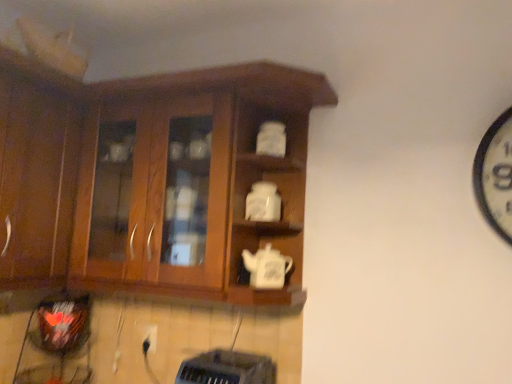
This screenshot has height=384, width=512. I want to click on white matte teapot at center, placed as the 1th teapot when sorted from top to bottom, so click(263, 203).

The image size is (512, 384). I want to click on wooden cabinet at left, arranged as the second cabinetry when viewed from the right, so click(x=37, y=170).

What do you see at coordinates (37, 170) in the screenshot?
I see `wooden cabinet at left, arranged as the second cabinetry when viewed from the right` at bounding box center [37, 170].

This screenshot has width=512, height=384. Find the location of `wooden cabinet at center, which is the first cabinetry from right to left`. wooden cabinet at center, which is the first cabinetry from right to left is located at coordinates (146, 176).

The height and width of the screenshot is (384, 512). I want to click on white matte teapot at center, the 1th teapot from the bottom, so click(x=267, y=267).

The image size is (512, 384). What do you see at coordinates (150, 339) in the screenshot? I see `white plastic electric outlet at lower center` at bounding box center [150, 339].

What are the coordinates of `white matte teapot at center, placed as the 1th teapot when sorted from top to bottom` in the screenshot? It's located at (263, 203).

Which is in front, point (69, 211) or point (256, 213)?

The point (256, 213) is in front.

Would you consider wooden cabinet at left, which appears as the first cabinetry when viewed from the left, to be distant from white matte teapot at center, placed as the 1th teapot when sorted from top to bottom?

That's not correct — wooden cabinet at left, which appears as the first cabinetry when viewed from the left, is a little close to white matte teapot at center, placed as the 1th teapot when sorted from top to bottom.

Would you say wooden cabinet at left, arranged as the second cabinetry when viewed from the right, is to the left or to the right of white matte teapot at center, the 2th teapot ordered from the bottom, in the picture?

wooden cabinet at left, arranged as the second cabinetry when viewed from the right, is to the left of white matte teapot at center, the 2th teapot ordered from the bottom.

Who is smaller, wooden cabinet at center, the second cabinetry in the left-to-right sequence, or black plastic toaster at lower center?

Smaller between the two is black plastic toaster at lower center.

Is wooden cabinet at center, which is the first cabinetry from right to left, thinner than black plastic toaster at lower center?

Yes, wooden cabinet at center, which is the first cabinetry from right to left, is thinner than black plastic toaster at lower center.

This screenshot has height=384, width=512. I want to click on appliance beneath the wooden cabinet at center, the second cabinetry in the left-to-right sequence (from a real-world perspective), so click(227, 368).

Does wooden cabinet at center, the second cabinetry in the left-to-right sequence, have a lesser height compared to black plastic toaster at lower center?

In fact, wooden cabinet at center, the second cabinetry in the left-to-right sequence, may be taller than black plastic toaster at lower center.

Between black plastic toaster at lower center and wooden cabinet at left, which appears as the first cabinetry when viewed from the left, which one appears on the right side from the viewer's perspective?

From the viewer's perspective, black plastic toaster at lower center appears more on the right side.

From a real-world perspective, between black plastic toaster at lower center and wooden cabinet at left, arranged as the second cabinetry when viewed from the right, who is vertically lower?

black plastic toaster at lower center, from a real-world perspective.

Is point (211, 379) closer or farther from the camera than point (16, 95)?

Point (211, 379).

From the picture: Are black plastic toaster at lower center and wooden cabinet at left, arranged as the second cabinetry when viewed from the right, beside each other?

No.

How different are the orientations of white plastic electric outlet at lower center and white matte teapot at center, the 2th teapot when ordered from top to bottom, in degrees?

The angle between the facing direction of white plastic electric outlet at lower center and the facing direction of white matte teapot at center, the 2th teapot when ordered from top to bottom, is 3.34 degrees.

Considering the sizes of objects white plastic electric outlet at lower center and white matte teapot at center, the 1th teapot from the bottom, in the image provided, who is thinner, white plastic electric outlet at lower center or white matte teapot at center, the 1th teapot from the bottom,?

white plastic electric outlet at lower center.

Between point (153, 348) and point (257, 283), which one is positioned behind?

The point (153, 348) is farther.

Is white plastic electric outlet at lower center next to white matte teapot at center, the 1th teapot from the bottom, and touching it?

white plastic electric outlet at lower center is not next to white matte teapot at center, the 1th teapot from the bottom, and they're not touching.

Are white matte teapot at center, the 1th teapot from the bottom, and white plastic electric outlet at lower center far apart?

No, white matte teapot at center, the 1th teapot from the bottom, is not far away from white plastic electric outlet at lower center.

Between white matte teapot at center, the 1th teapot from the bottom, and white plastic electric outlet at lower center, which one appears on the left side from the viewer's perspective?

Positioned to the left is white plastic electric outlet at lower center.

From the image's perspective, which object appears higher, white matte teapot at center, the 2th teapot when ordered from top to bottom, or white plastic electric outlet at lower center?

From the image's view, white matte teapot at center, the 2th teapot when ordered from top to bottom, is above.

From a real-world perspective, between white matte teapot at center, the 1th teapot from the bottom, and white plastic electric outlet at lower center, who is vertically lower?

white plastic electric outlet at lower center is physically lower.

How much distance is there between wooden cabinet at center, the second cabinetry in the left-to-right sequence, and white matte teapot at center, placed as the 1th teapot when sorted from top to bottom?

wooden cabinet at center, the second cabinetry in the left-to-right sequence, and white matte teapot at center, placed as the 1th teapot when sorted from top to bottom, are 17.66 inches apart.

Is wooden cabinet at center, which is the first cabinetry from right to left, turned away from white matte teapot at center, the 2th teapot ordered from the bottom?

Yes, wooden cabinet at center, which is the first cabinetry from right to left, is facing away from white matte teapot at center, the 2th teapot ordered from the bottom.

Is white matte teapot at center, placed as the 1th teapot when sorted from top to bottom, completely or partially inside wooden cabinet at center, the second cabinetry in the left-to-right sequence?

Yes, wooden cabinet at center, the second cabinetry in the left-to-right sequence, contains white matte teapot at center, placed as the 1th teapot when sorted from top to bottom.

Considering the sizes of wooden cabinet at center, the second cabinetry in the left-to-right sequence, and white matte teapot at center, placed as the 1th teapot when sorted from top to bottom, in the image, is wooden cabinet at center, the second cabinetry in the left-to-right sequence, wider or thinner than white matte teapot at center, placed as the 1th teapot when sorted from top to bottom,?

wooden cabinet at center, the second cabinetry in the left-to-right sequence, is wider than white matte teapot at center, placed as the 1th teapot when sorted from top to bottom.

Between white plastic electric outlet at lower center and wooden cabinet at center, the second cabinetry in the left-to-right sequence, which one has less height?

With less height is white plastic electric outlet at lower center.

The height and width of the screenshot is (384, 512). I want to click on electric outlet behind the wooden cabinet at center, the second cabinetry in the left-to-right sequence, so click(x=150, y=339).

From the image's perspective, is white plastic electric outlet at lower center beneath wooden cabinet at center, the second cabinetry in the left-to-right sequence?

Yes, from the image's perspective, white plastic electric outlet at lower center is beneath wooden cabinet at center, the second cabinetry in the left-to-right sequence.

I want to click on the 1st teapot counting from the right of the wooden cabinet at left, which appears as the first cabinetry when viewed from the left, so click(263, 203).

In order to click on appliance below the wooden cabinet at center, the second cabinetry in the left-to-right sequence (from a real-world perspective) in this screenshot , I will do `click(227, 368)`.

Based on their spatial positions, is wooden cabinet at left, which appears as the first cabinetry when viewed from the left, or white plastic electric outlet at lower center closer to white matte teapot at center, the 1th teapot from the bottom?

white plastic electric outlet at lower center.

Looking at the image, which one is located further to black plastic toaster at lower center, white matte teapot at center, the 1th teapot from the bottom, or white matte teapot at center, the 2th teapot ordered from the bottom?

white matte teapot at center, the 2th teapot ordered from the bottom, lies further to black plastic toaster at lower center than the other object.

Looking at the image, which one is located closer to black plastic toaster at lower center, wooden cabinet at center, the second cabinetry in the left-to-right sequence, or white matte teapot at center, the 2th teapot ordered from the bottom?

white matte teapot at center, the 2th teapot ordered from the bottom, is positioned closer to the anchor black plastic toaster at lower center.

Consider the image. Based on their spatial positions, is black plastic toaster at lower center or wooden cabinet at left, which appears as the first cabinetry when viewed from the left, closer to wooden cabinet at center, which is the first cabinetry from right to left?

wooden cabinet at left, which appears as the first cabinetry when viewed from the left, is positioned closer to the anchor wooden cabinet at center, which is the first cabinetry from right to left.

Which object lies nearer to the anchor point white matte teapot at center, the 2th teapot ordered from the bottom, white matte teapot at center, the 1th teapot from the bottom, or wooden cabinet at left, arranged as the second cabinetry when viewed from the right?

white matte teapot at center, the 1th teapot from the bottom, is closer to white matte teapot at center, the 2th teapot ordered from the bottom.

Based on their spatial positions, is wooden cabinet at center, the second cabinetry in the left-to-right sequence, or white plastic electric outlet at lower center further from white matte teapot at center, placed as the 1th teapot when sorted from top to bottom?

white plastic electric outlet at lower center.

Considering their positions, is wooden cabinet at left, arranged as the second cabinetry when viewed from the right, positioned further to white matte teapot at center, the 2th teapot ordered from the bottom, than white matte teapot at center, the 2th teapot when ordered from top to bottom?

wooden cabinet at left, arranged as the second cabinetry when viewed from the right, is positioned further to the anchor white matte teapot at center, the 2th teapot ordered from the bottom.

Which object lies nearer to the anchor point black plastic toaster at lower center, white matte teapot at center, the 2th teapot when ordered from top to bottom, or wooden cabinet at center, the second cabinetry in the left-to-right sequence?

Among the two, white matte teapot at center, the 2th teapot when ordered from top to bottom, is located nearer to black plastic toaster at lower center.

Locate an element on the screen. The width and height of the screenshot is (512, 384). cabinetry situated between wooden cabinet at left, which appears as the first cabinetry when viewed from the left, and black plastic toaster at lower center from left to right is located at coordinates (146, 176).

Locate an element on the screen. electric outlet between wooden cabinet at center, the second cabinetry in the left-to-right sequence, and black plastic toaster at lower center from top to bottom is located at coordinates (150, 339).

This screenshot has width=512, height=384. In order to click on teapot between white matte teapot at center, the 2th teapot ordered from the bottom, and black plastic toaster at lower center, in the vertical direction in this screenshot , I will do coord(267,267).

Where is `cabinetry between wooden cabinet at left, arranged as the second cabinetry when viewed from the right, and white matte teapot at center, the 1th teapot from the bottom`? This screenshot has height=384, width=512. cabinetry between wooden cabinet at left, arranged as the second cabinetry when viewed from the right, and white matte teapot at center, the 1th teapot from the bottom is located at coordinates (146, 176).